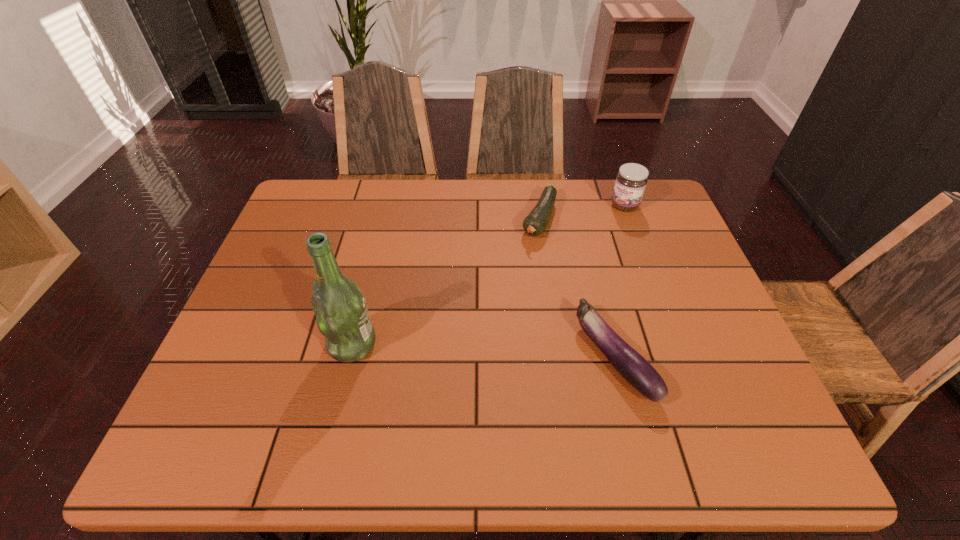
Where is `blank area in the image that satisfies the following two spatial constraints: 1. on the front side of the zucchini; 2. on the left side of the eggplant`? blank area in the image that satisfies the following two spatial constraints: 1. on the front side of the zucchini; 2. on the left side of the eggplant is located at coordinates (560, 357).

The image size is (960, 540). Identify the location of free location that satisfies the following two spatial constraints: 1. on the back side of the third shortest object; 2. on the left side of the zucchini. (538, 206).

Find the location of `free point that satisfies the following two spatial constraints: 1. on the back side of the jam; 2. on the left side of the eggplant`. free point that satisfies the following two spatial constraints: 1. on the back side of the jam; 2. on the left side of the eggplant is located at coordinates (576, 206).